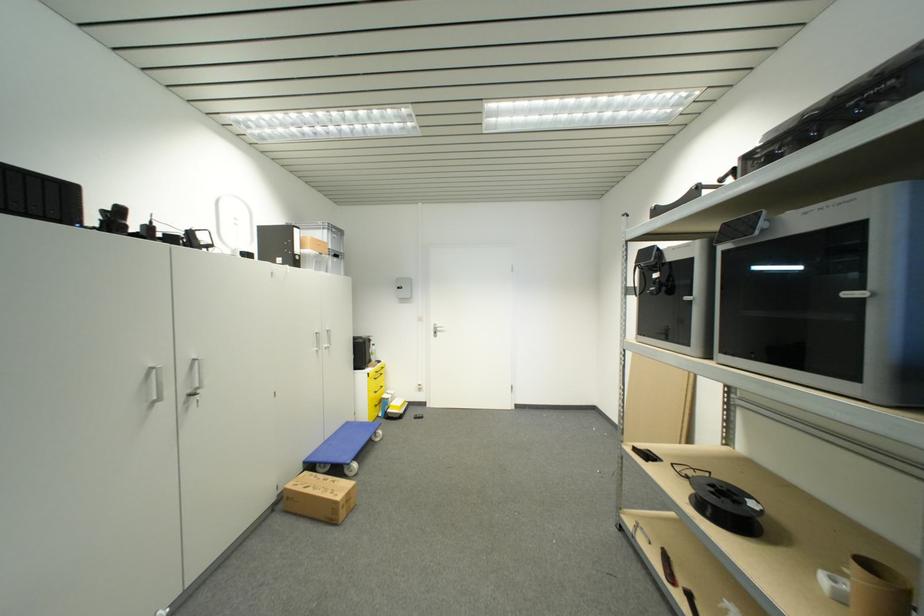
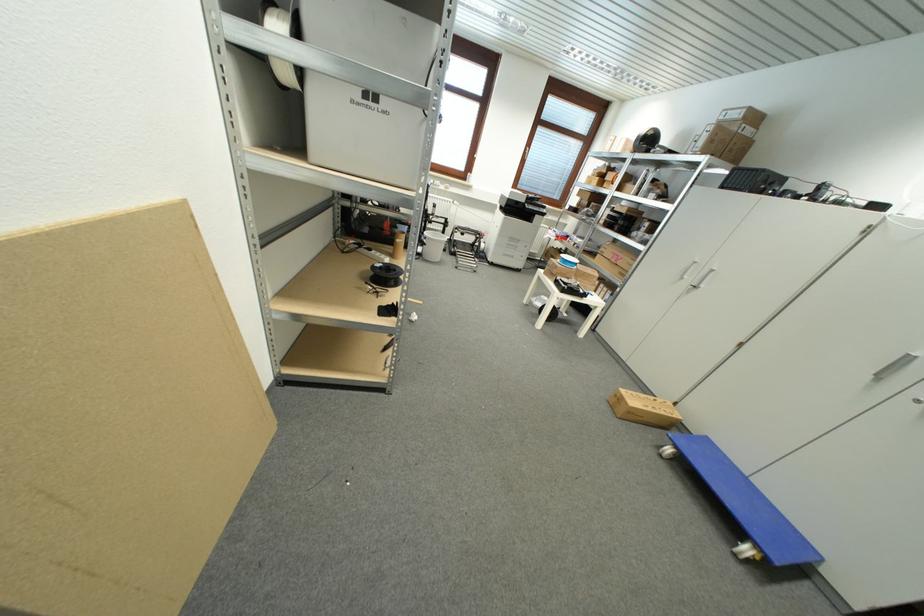
Locate, in the second image, the point that corresponds to point 309,464 in the first image.

(711, 440)